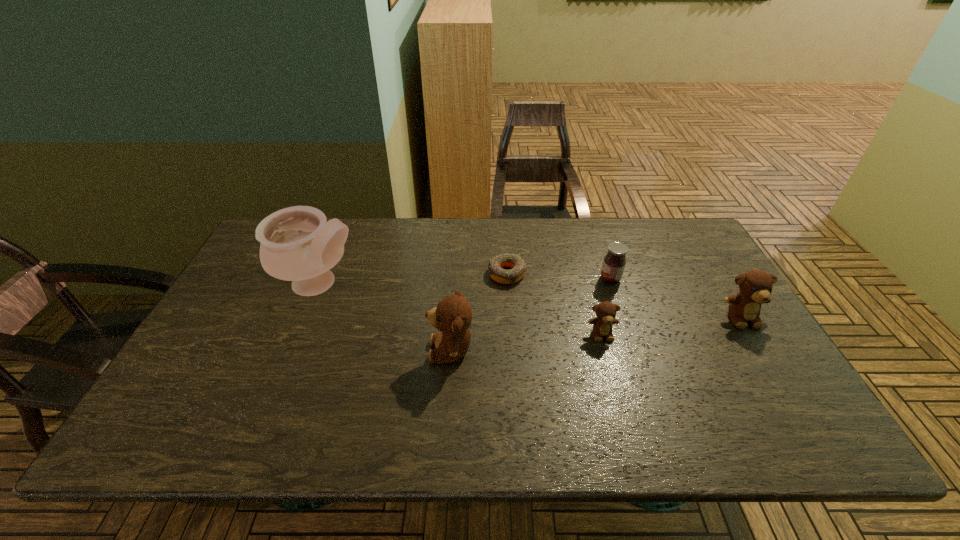
The width and height of the screenshot is (960, 540). In order to click on the leftmost teddy bear in this screenshot , I will do `click(452, 317)`.

You are a GUI agent. You are given a task and a screenshot of the screen. Output one action in this format:
    pyautogui.click(x=<x>, y=<y>)
    Task: Click on the shortest teddy bear
    Image resolution: width=960 pixels, height=540 pixels.
    Given the screenshot: What is the action you would take?
    606,311

Locate an element on the screen. the fifth tallest object is located at coordinates (606, 311).

I want to click on the second shortest teddy bear, so pos(755,286).

Locate an element on the screen. the rightmost object is located at coordinates (755, 286).

The image size is (960, 540). Find the location of `the leftmost object`. the leftmost object is located at coordinates (297, 244).

Locate an element on the screen. the tallest object is located at coordinates (297, 244).

This screenshot has width=960, height=540. I want to click on doughnut, so click(x=495, y=266).

Where is `the third object from left to right`? The height and width of the screenshot is (540, 960). the third object from left to right is located at coordinates (495, 266).

Locate an element on the screen. This screenshot has height=540, width=960. jam is located at coordinates [x=614, y=262].